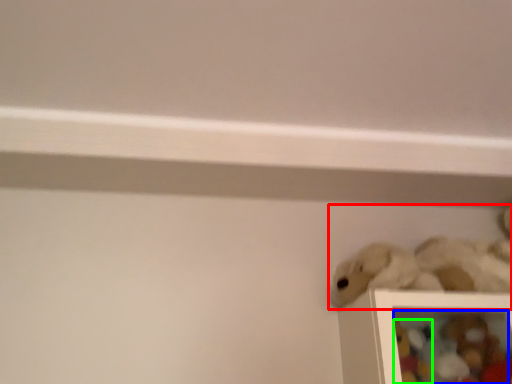
Question: Considering the real-world distances, which object is farthest from toy (highlighted by a red box)? toy (highlighted by a blue box) or toy (highlighted by a green box)?

Choices:
 (A) toy
 (B) toy

Answer: (B)